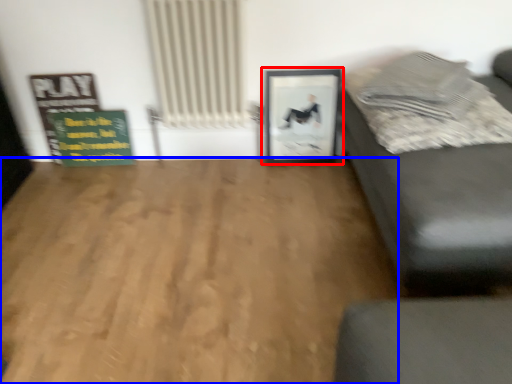
Question: Which object appears closest to the camera in this image, picture frame (highlighted by a red box) or hardwood (highlighted by a blue box)?

Choices:
 (A) picture frame
 (B) hardwood

Answer: (B)